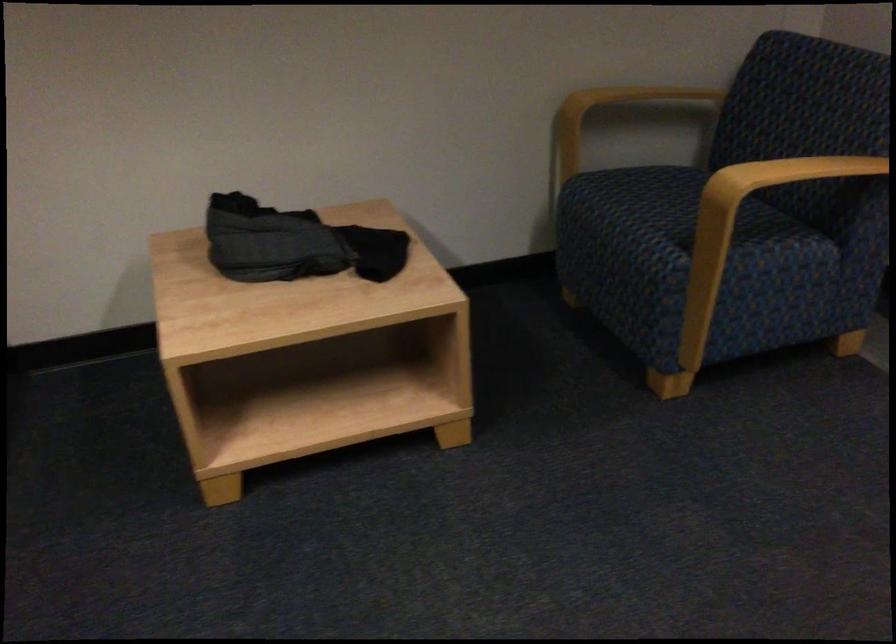
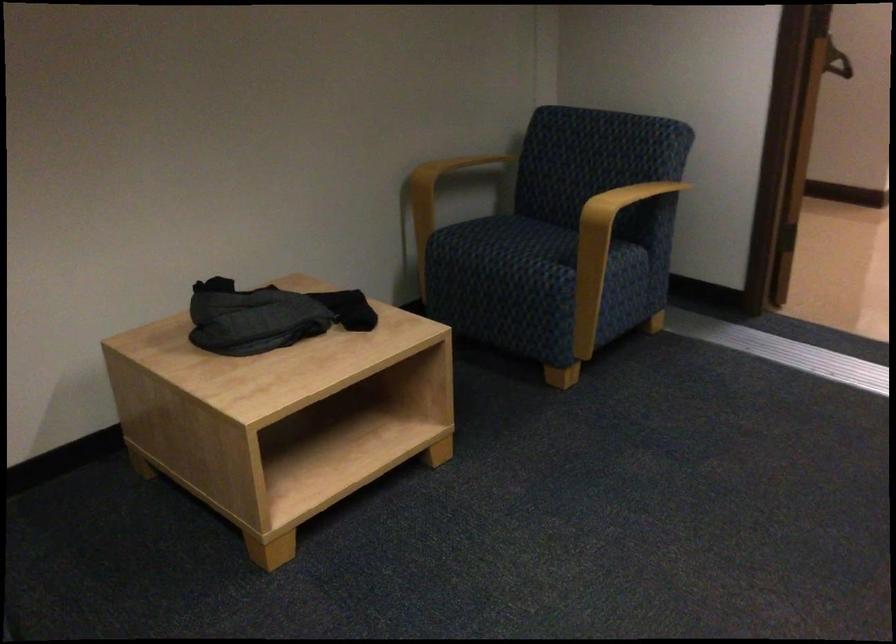
Find the pixel in the second image that matches (668,205) in the first image.

(523, 242)